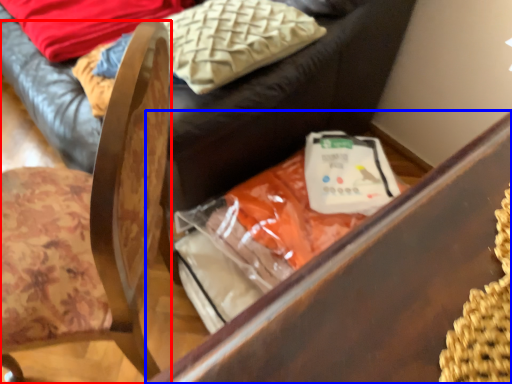
Question: Which object appears farthest to the camera in this image, chair (highlighted by a red box) or furniture (highlighted by a blue box)?

Choices:
 (A) chair
 (B) furniture

Answer: (B)